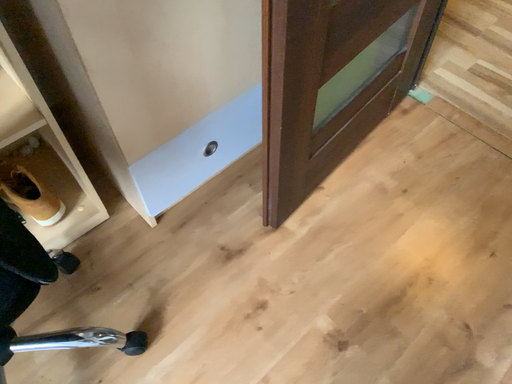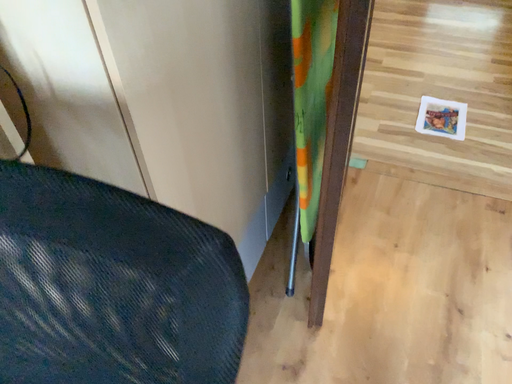
Question: How did the camera likely rotate when shooting the video?

Choices:
 (A) rotated left
 (B) rotated right

Answer: (B)